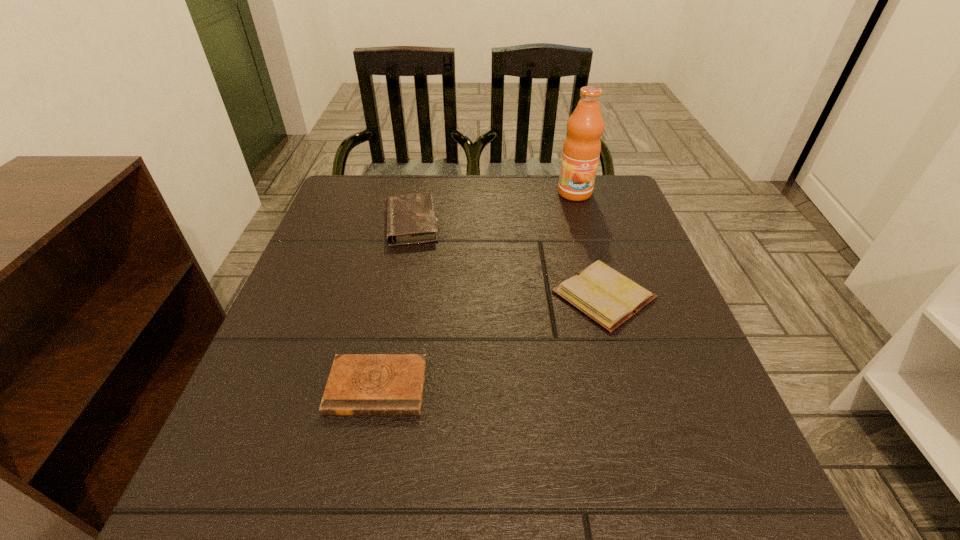
Where is `empty space between the farthest object and the farthest diary`? This screenshot has height=540, width=960. empty space between the farthest object and the farthest diary is located at coordinates (493, 208).

Locate an element on the screen. free space between the second nearest diary and the nearest diary is located at coordinates (491, 341).

This screenshot has width=960, height=540. Find the location of `free spot between the second tallest object and the nearest diary`. free spot between the second tallest object and the nearest diary is located at coordinates (395, 305).

You are a GUI agent. You are given a task and a screenshot of the screen. Output one action in this format:
    pyautogui.click(x=<x>, y=<y>)
    Task: Click on the vacant space that is in between the second nearest object and the nearest diary
    The width and height of the screenshot is (960, 540).
    Given the screenshot: What is the action you would take?
    pyautogui.click(x=491, y=341)

Choose which object is the nearest neighbor to the second farthest diary. Please provide its 2D coordinates. Your answer should be formatted as a tuple, i.e. [(x, y)], where the tuple contains the x and y coordinates of a point satisfying the conditions above.

[(582, 146)]

You are a GUI agent. You are given a task and a screenshot of the screen. Output one action in this format:
    pyautogui.click(x=<x>, y=<y>)
    Task: Click on the object that stands as the third closest to the farthest object
    
    Given the screenshot: What is the action you would take?
    pyautogui.click(x=359, y=384)

Find the location of `diary that is the closest to the nearest diary`. diary that is the closest to the nearest diary is located at coordinates (609, 298).

Identify which diary is located as the nearest to the rightmost diary. Please provide its 2D coordinates. Your answer should be formatted as a tuple, i.e. [(x, y)], where the tuple contains the x and y coordinates of a point satisfying the conditions above.

[(359, 384)]

You are a GUI agent. You are given a task and a screenshot of the screen. Output one action in this format:
    pyautogui.click(x=<x>, y=<y>)
    Task: Click on the free space that satisfies the following two spatial constraints: 1. on the front side of the third nearest object; 2. on the right side of the second nearest object
    
    Given the screenshot: What is the action you would take?
    pyautogui.click(x=397, y=295)